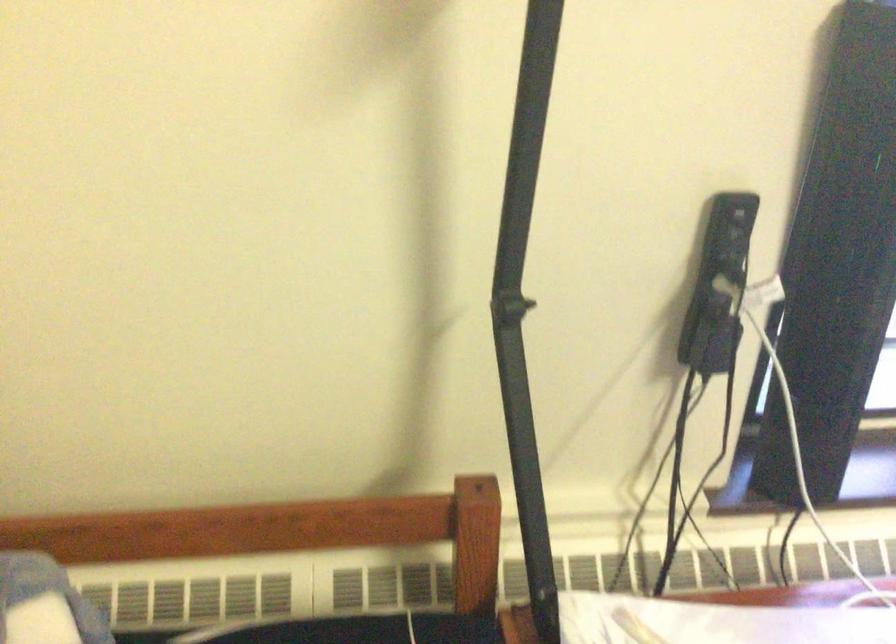
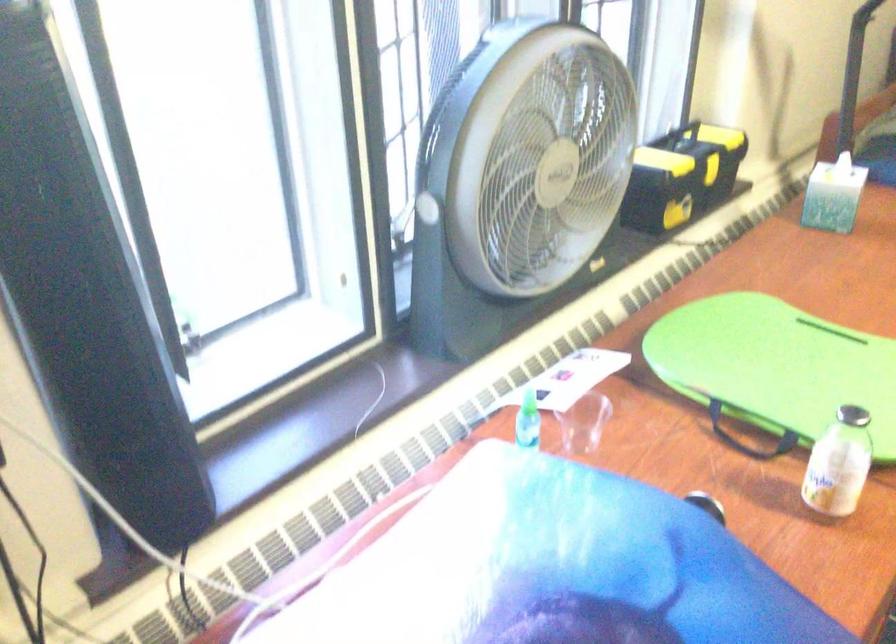
Question: Based on the continuous images, in which direction is the camera rotating? Reply with the corresponding letter.

Choices:
 (A) Left
 (B) Right
 (C) Up
 (D) Down

Answer: (B)